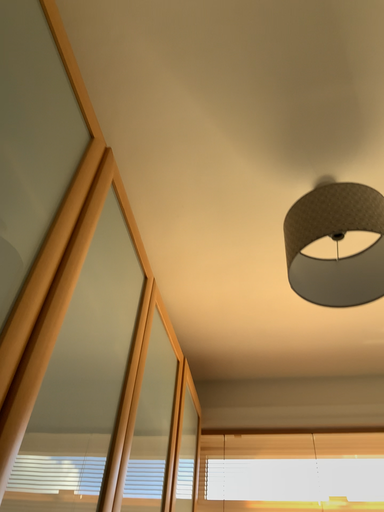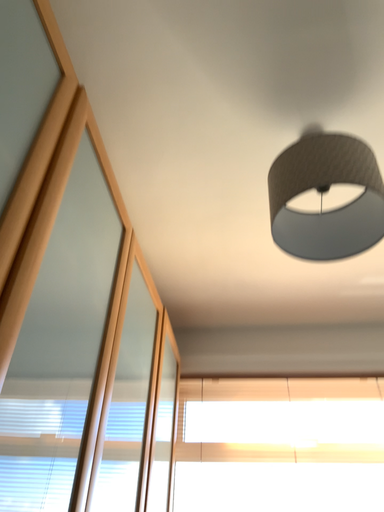
Question: Which way did the camera rotate in the video?

Choices:
 (A) rotated downward
 (B) rotated upward

Answer: (A)